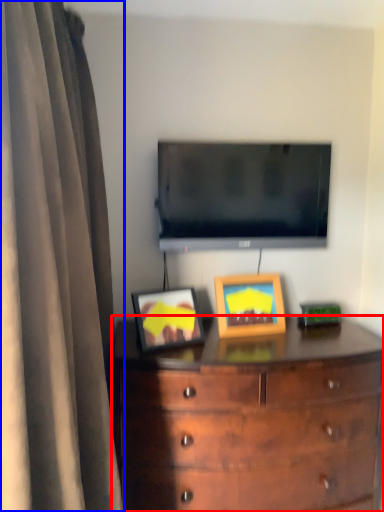
Question: Which of the following is the farthest to the observer, chest of drawers (highlighted by a red box) or curtain (highlighted by a blue box)?

Choices:
 (A) chest of drawers
 (B) curtain

Answer: (A)